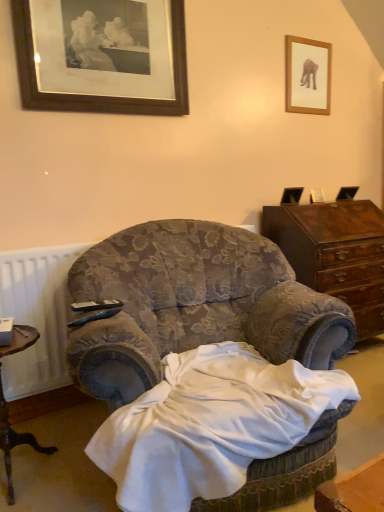
Question: Which direction should I rotate to face black plastic remote control at center, the 2th remote control positioned from the front, — up or down?

Choices:
 (A) up
 (B) down

Answer: (B)

Question: Could you tell me if velvet floral armchair at center is facing black plastic remote control at lower left, the 1th remote control positioned from the front?

Choices:
 (A) yes
 (B) no

Answer: (B)

Question: From the image's perspective, is velvet floral armchair at center on black plastic remote control at lower left, the 1th remote control positioned from the front?

Choices:
 (A) yes
 (B) no

Answer: (B)

Question: Considering the relative positions of velvet floral armchair at center and black plastic remote control at lower left, acting as the 2th remote control starting from the back, in the image provided, is velvet floral armchair at center in front of black plastic remote control at lower left, acting as the 2th remote control starting from the back,?

Choices:
 (A) no
 (B) yes

Answer: (B)

Question: Can you confirm if velvet floral armchair at center is smaller than black plastic remote control at lower left, the 1th remote control positioned from the front?

Choices:
 (A) no
 (B) yes

Answer: (A)

Question: Is velvet floral armchair at center thinner than black plastic remote control at lower left, acting as the 2th remote control starting from the back?

Choices:
 (A) yes
 (B) no

Answer: (B)

Question: Can you confirm if velvet floral armchair at center is wider than black plastic remote control at lower left, acting as the 2th remote control starting from the back?

Choices:
 (A) yes
 (B) no

Answer: (A)

Question: From the image's perspective, does brown wooden desk at lower left appear lower than wooden picture frame at upper left, arranged as the 1th picture frame when viewed from the front?

Choices:
 (A) yes
 (B) no

Answer: (A)

Question: Is brown wooden desk at lower left looking in the opposite direction of wooden picture frame at upper left, the first picture frame from the left?

Choices:
 (A) yes
 (B) no

Answer: (B)

Question: Is brown wooden desk at lower left beside wooden picture frame at upper left, the first picture frame from the left?

Choices:
 (A) no
 (B) yes

Answer: (A)

Question: Would you say brown wooden desk at lower left is a long distance from wooden picture frame at upper left, arranged as the 1th picture frame when viewed from the front?

Choices:
 (A) no
 (B) yes

Answer: (B)

Question: Does brown wooden desk at lower left have a greater height compared to wooden picture frame at upper left, arranged as the 1th picture frame when viewed from the front?

Choices:
 (A) no
 (B) yes

Answer: (A)

Question: Is brown wooden desk at lower left not within wooden picture frame at upper left, arranged as the 1th picture frame when viewed from the front?

Choices:
 (A) yes
 (B) no

Answer: (A)

Question: Is black plastic remote control at lower left, acting as the 2th remote control starting from the back, further to the viewer compared to black plastic remote control at center, the 1th remote control in the back-to-front sequence?

Choices:
 (A) no
 (B) yes

Answer: (A)